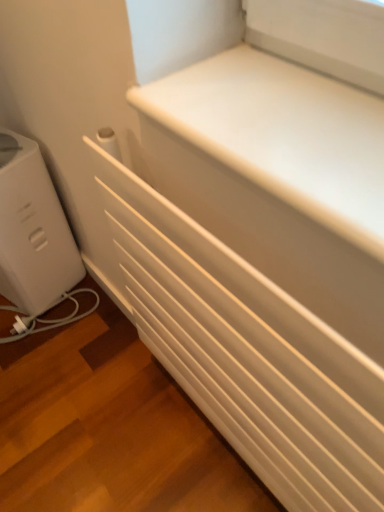
Question: From the image's perspective, is white plastic toaster at left under white matte radiator at center?

Choices:
 (A) no
 (B) yes

Answer: (A)

Question: Considering the relative positions of white plastic toaster at left and white matte radiator at center in the image provided, is white plastic toaster at left to the right of white matte radiator at center from the viewer's perspective?

Choices:
 (A) yes
 (B) no

Answer: (B)

Question: Is the position of white plastic toaster at left more distant than that of white matte radiator at center?

Choices:
 (A) yes
 (B) no

Answer: (A)

Question: Is white plastic toaster at left at the left side of white matte radiator at center?

Choices:
 (A) no
 (B) yes

Answer: (B)

Question: Considering the relative sizes of white plastic toaster at left and white matte radiator at center in the image provided, is white plastic toaster at left shorter than white matte radiator at center?

Choices:
 (A) yes
 (B) no

Answer: (A)

Question: Relative to white matte radiator at lower left, is white plastic toaster at left in front or behind?

Choices:
 (A) behind
 (B) front

Answer: (A)

Question: From a real-world perspective, is white plastic toaster at left physically located above or below white matte radiator at lower left?

Choices:
 (A) below
 (B) above

Answer: (B)

Question: Does point (41, 270) appear closer or farther from the camera than point (97, 287)?

Choices:
 (A) farther
 (B) closer

Answer: (B)

Question: Is white plastic toaster at left taller or shorter than white matte radiator at lower left?

Choices:
 (A) short
 (B) tall

Answer: (B)

Question: Is white matte radiator at center in front of or behind white matte radiator at lower left in the image?

Choices:
 (A) front
 (B) behind

Answer: (A)

Question: In terms of width, does white matte radiator at center look wider or thinner when compared to white matte radiator at lower left?

Choices:
 (A) thin
 (B) wide

Answer: (A)

Question: Considering the positions of point (223, 366) and point (243, 490), is point (223, 366) closer or farther from the camera than point (243, 490)?

Choices:
 (A) farther
 (B) closer

Answer: (B)

Question: From the image's perspective, is white matte radiator at center located above or below white matte radiator at lower left?

Choices:
 (A) above
 (B) below

Answer: (A)

Question: From a real-world perspective, is white matte radiator at lower left physically located above or below white plastic toaster at left?

Choices:
 (A) above
 (B) below

Answer: (B)

Question: Considering the positions of white matte radiator at lower left and white plastic toaster at left in the image, is white matte radiator at lower left bigger or smaller than white plastic toaster at left?

Choices:
 (A) big
 (B) small

Answer: (B)